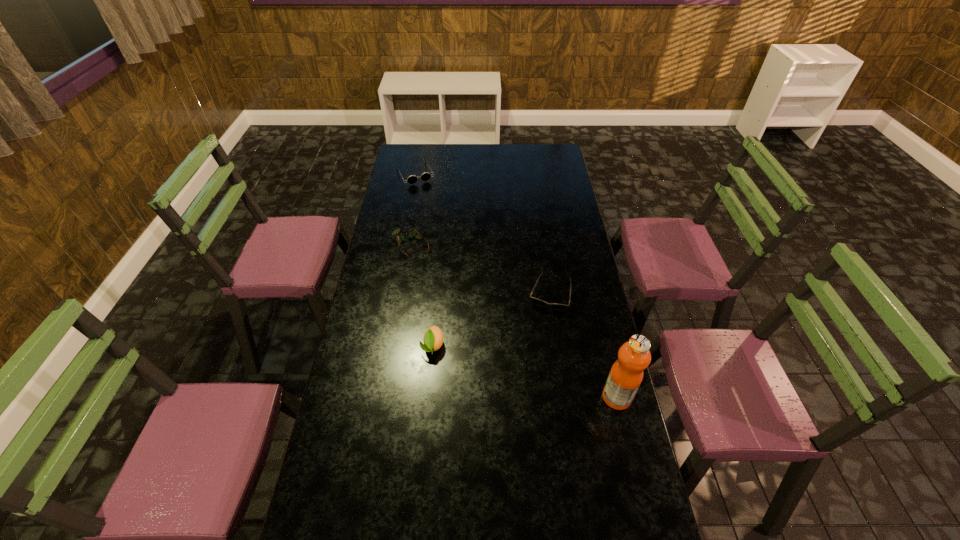
What are the coordinates of `lemon` in the screenshot? It's located at (433, 338).

This screenshot has width=960, height=540. Find the location of `the fourth farthest object`. the fourth farthest object is located at coordinates (433, 338).

Where is `the nearest object`? the nearest object is located at coordinates (626, 374).

This screenshot has height=540, width=960. Find the location of `the rightmost object`. the rightmost object is located at coordinates (626, 374).

Locate an element on the screen. This screenshot has height=540, width=960. spectacles is located at coordinates (412, 233).

You are a GUI agent. You are given a task and a screenshot of the screen. Output one action in this format:
    pyautogui.click(x=<x>, y=<y>)
    Task: Click on the taller sunglasses
    The image size is (960, 540).
    Given the screenshot: What is the action you would take?
    pyautogui.click(x=425, y=176)

The image size is (960, 540). Identify the location of the left sunglasses. (425, 176).

At what (x,y) coordinates should I click in order to perform the action: click on the right sunglasses. Please return your answer as a coordinate pair (x, y). Looking at the image, I should click on (556, 306).

Identify the location of the second object from right to left. (556, 306).

The width and height of the screenshot is (960, 540). Find the location of `free space located 0.240m with leaves positioned above the third object from right to left`. free space located 0.240m with leaves positioned above the third object from right to left is located at coordinates (425, 427).